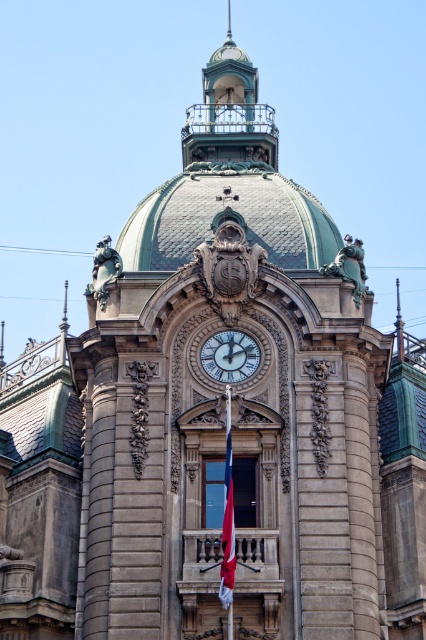
Which of these two, white glossy clock at center or red fabric flag at center, stands taller?

red fabric flag at center is taller.

Does white glossy clock at center come in front of red fabric flag at center?

No, it is not.

Describe the element at coordinates (230, 355) in the screenshot. I see `white glossy clock at center` at that location.

Locate an element on the screen. white glossy clock at center is located at coordinates (230, 355).